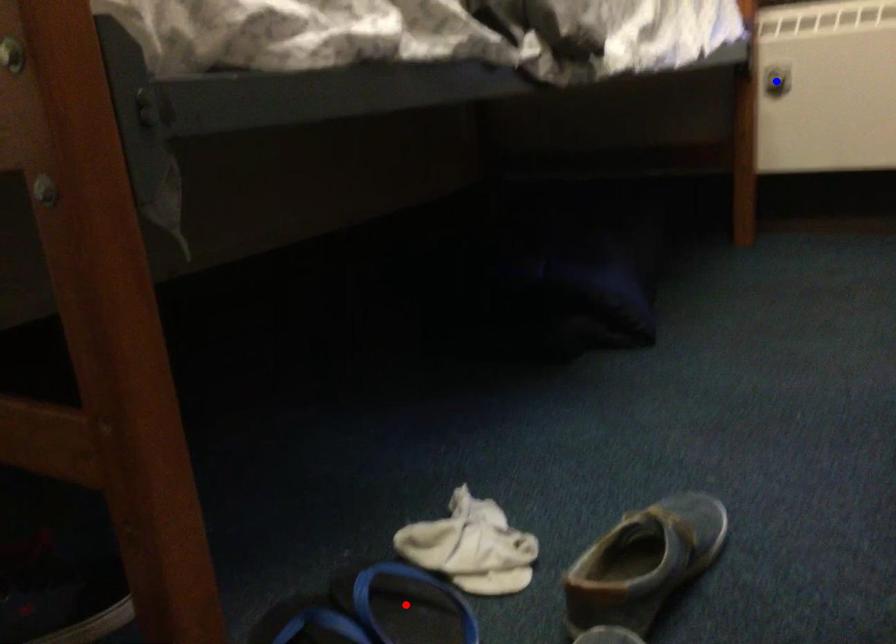
Question: Which of the two points in the image is closer to the camera?

Choices:
 (A) Blue point is closer.
 (B) Red point is closer.

Answer: (B)